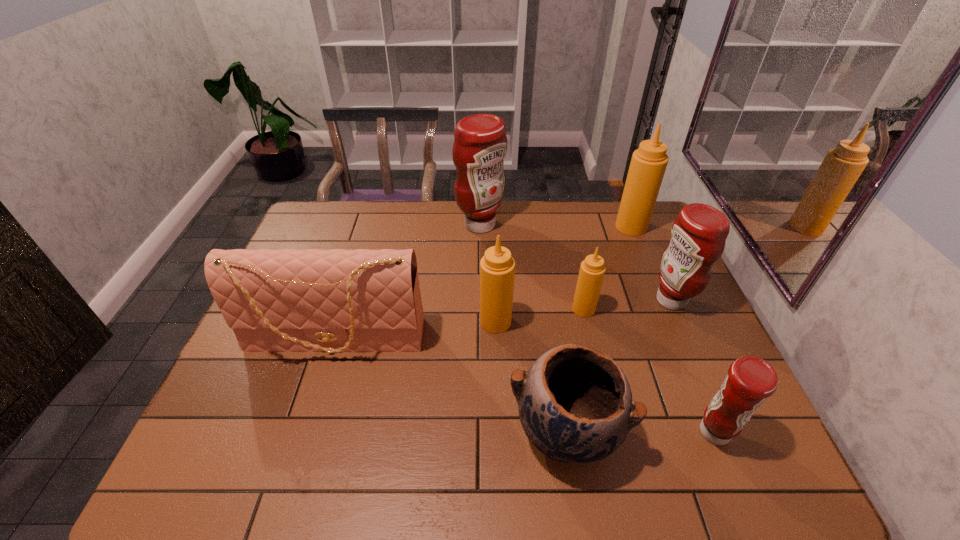
You are a GUI agent. You are given a task and a screenshot of the screen. Output one action in this format:
    pyautogui.click(x=<x>, y=<y>)
    Task: Click on the vacant area at the near left corner
    This screenshot has width=960, height=540.
    Given the screenshot: What is the action you would take?
    pyautogui.click(x=218, y=476)

Image resolution: width=960 pixels, height=540 pixels. I want to click on blank area at the far right corner, so click(x=659, y=234).

Where is `vacant area that lies between the second smallest red condiment and the nearest condiment`? vacant area that lies between the second smallest red condiment and the nearest condiment is located at coordinates 693,366.

Find the location of a particular element. Image resolution: width=960 pixels, height=540 pixels. vacant space that is in between the smallest red condiment and the second smallest red condiment is located at coordinates (693, 366).

This screenshot has width=960, height=540. Identify the location of free spot between the fourth condiment from right to left and the farthest red condiment. (532, 267).

Where is `vacant space that's between the rightmost tan condiment and the leftmost tan condiment`? vacant space that's between the rightmost tan condiment and the leftmost tan condiment is located at coordinates (564, 274).

Locate an element on the screen. Image resolution: width=960 pixels, height=540 pixels. unoccupied area between the biggest red condiment and the pottery is located at coordinates (523, 328).

At what (x,y) coordinates should I click in order to perform the action: click on free space that is in between the handbag and the smallest tan condiment. Please return your answer as a coordinate pair (x, y). Looking at the image, I should click on (460, 325).

This screenshot has width=960, height=540. I want to click on object that stands as the third closest to the biggest red condiment, so click(289, 300).

Select which object appears as the closest to the second smallest red condiment. Please provide its 2D coordinates. Your answer should be formatted as a tuple, i.e. [(x, y)], where the tuple contains the x and y coordinates of a point satisfying the conditions above.

[(592, 270)]